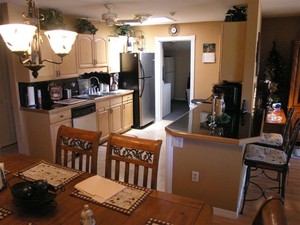
At what (x,y) coordinates should I click in order to perform the action: click on refridgerator. Please return your answer as a coordinate pair (x, y). Looking at the image, I should click on (149, 89).